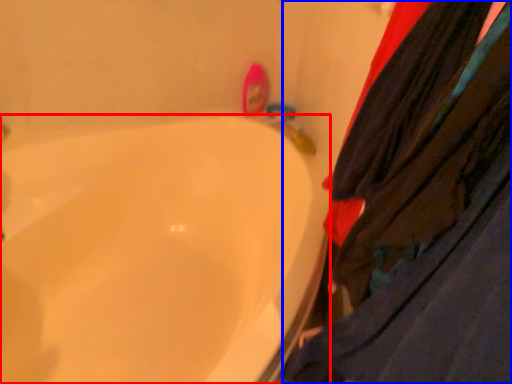
Question: Among these objects, which one is farthest to the camera, bathtub (highlighted by a red box) or clothing (highlighted by a blue box)?

Choices:
 (A) bathtub
 (B) clothing

Answer: (A)